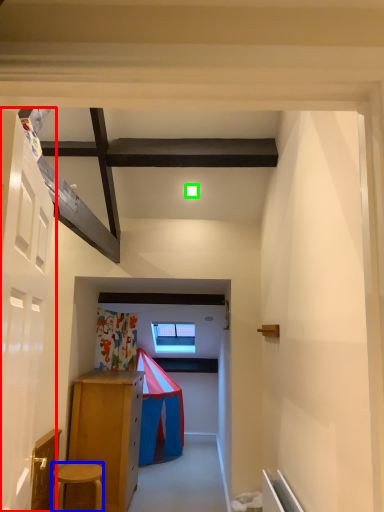
Question: Considering the real-world distances, which object is closest to door (highlighted by a red box)? stool (highlighted by a blue box) or light (highlighted by a green box).

Choices:
 (A) stool
 (B) light

Answer: (A)